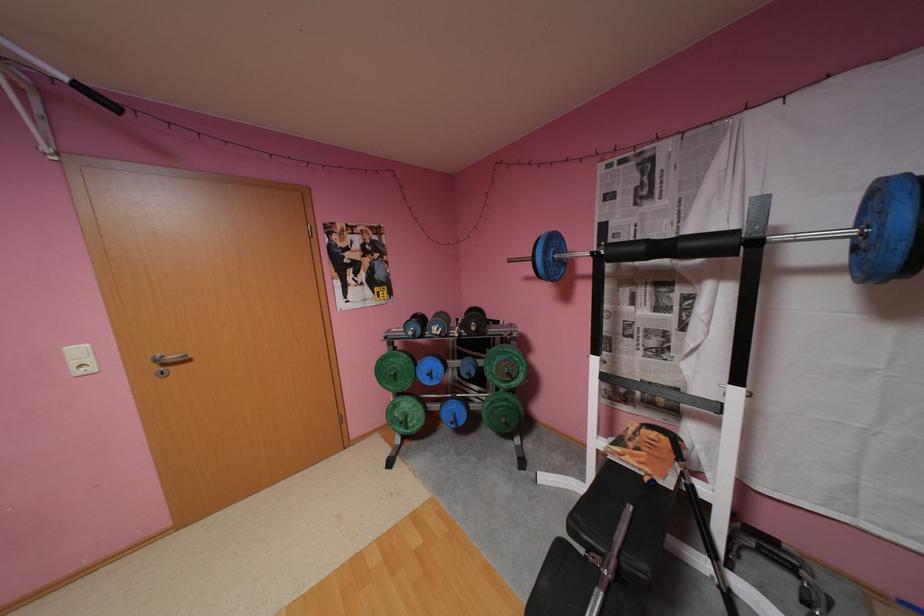
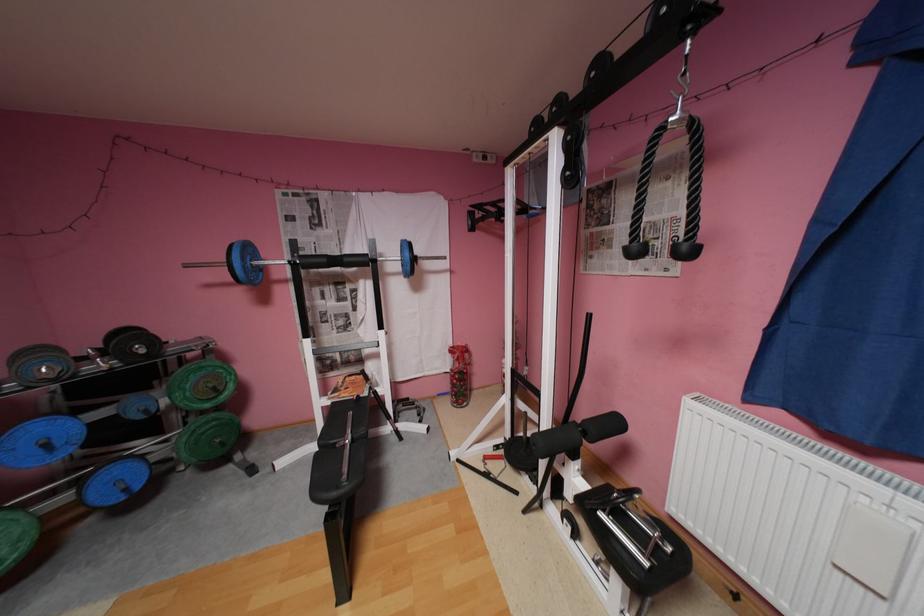
Find the pixel in the second image that matches [482,328] in the first image.

(152, 351)